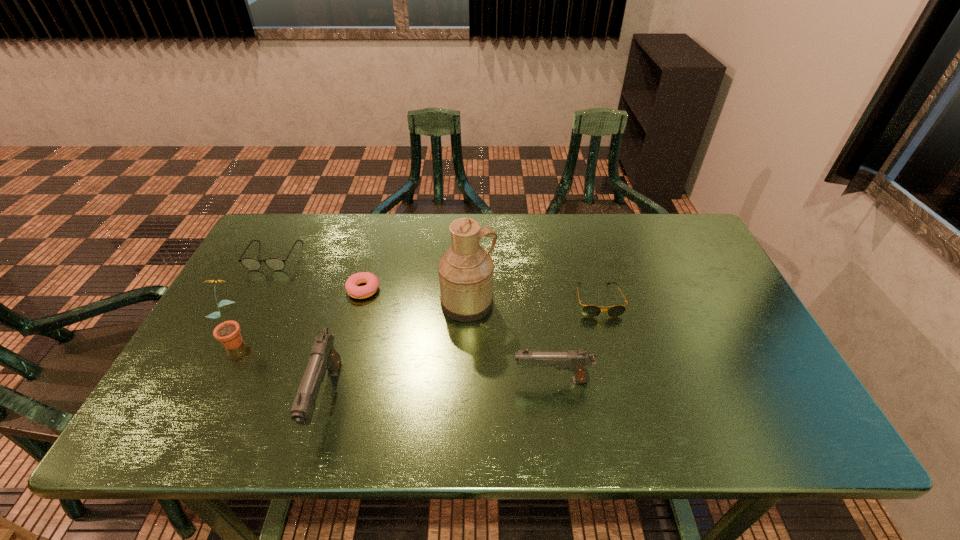
At what (x,y) coordinates should I click in order to perform the action: click on the third tallest object. Please return your answer as a coordinate pair (x, y). This screenshot has width=960, height=540. Looking at the image, I should click on (323, 355).

Locate an element on the screen. The width and height of the screenshot is (960, 540). the left gun is located at coordinates (323, 355).

You are a GUI agent. You are given a task and a screenshot of the screen. Output one action in this format:
    pyautogui.click(x=<x>, y=<y>)
    Task: Click on the right gun
    The image size is (960, 540).
    Given the screenshot: What is the action you would take?
    pyautogui.click(x=577, y=361)

Where is `the shorter gun`? the shorter gun is located at coordinates 577,361.

Where is `the shortest object`? This screenshot has width=960, height=540. the shortest object is located at coordinates (358, 292).

Image resolution: width=960 pixels, height=540 pixels. Identify the location of the rightmost object. (589, 310).

The height and width of the screenshot is (540, 960). I want to click on sunflower, so click(x=228, y=333).

The image size is (960, 540). What are the coordinates of `the third nearest object` in the screenshot? It's located at (228, 333).

In order to click on the farthest object in this screenshot , I will do 252,264.

You are a GUI agent. You are given a task and a screenshot of the screen. Output one action in this format:
    pyautogui.click(x=<x>, y=<y>)
    Task: Click on the pitcher
    
    Given the screenshot: What is the action you would take?
    pyautogui.click(x=466, y=272)